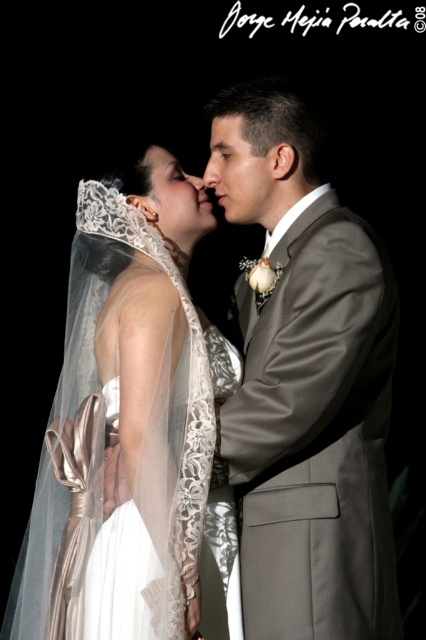
Question: Which point is closer to the camera taking this photo?

Choices:
 (A) (66, 484)
 (B) (213, 184)
 (C) (278, 150)
 (D) (198, 179)

Answer: (A)

Question: Which point is closer to the camera?

Choices:
 (A) (175, 305)
 (B) (259, 484)
 (C) (222, 161)
 (D) (198, 179)

Answer: (A)

Question: Which object is positioned closest to the matte gray suit at center?

Choices:
 (A) matte white nose at center
 (B) matte skin nose at center
 (C) white lace veil at upper left

Answer: (C)

Question: From the image, what is the correct spatial relationship of matte gray suit at center in relation to matte white veil at center?

Choices:
 (A) right
 (B) left

Answer: (A)

Question: Is smooth skin face at center above matte white nose at center?

Choices:
 (A) yes
 (B) no

Answer: (B)

Question: Does smooth skin face at center lie behind matte skin nose at center?

Choices:
 (A) yes
 (B) no

Answer: (B)